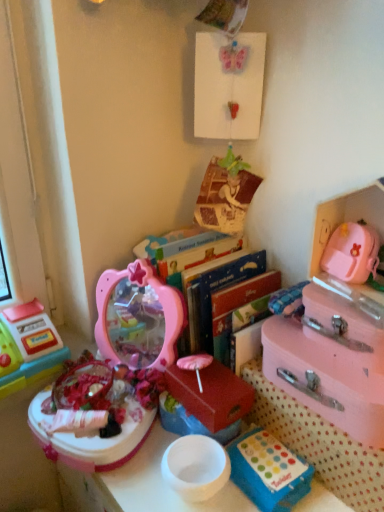
Identify the location of empty space that is ontop of pink matte suitcase at right, the 4th storage box positioned from the left (from a real-world perspective). The width and height of the screenshot is (384, 512). (336, 352).